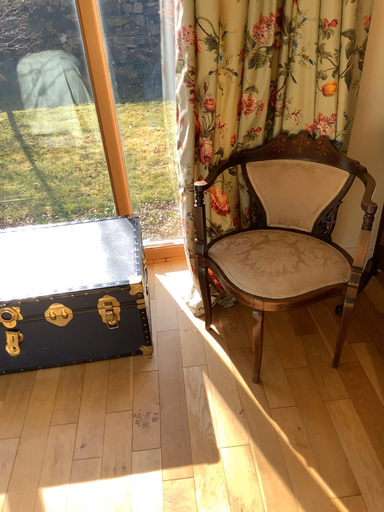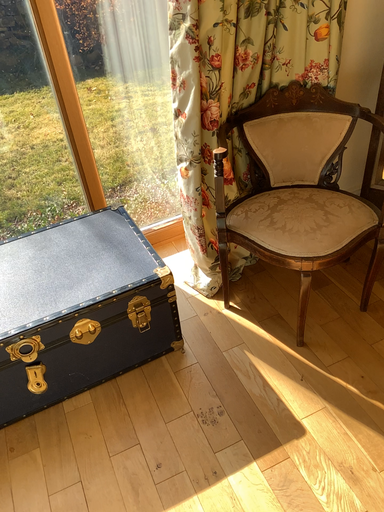
Question: How did the camera likely rotate when shooting the video?

Choices:
 (A) rotated left
 (B) rotated right

Answer: (B)